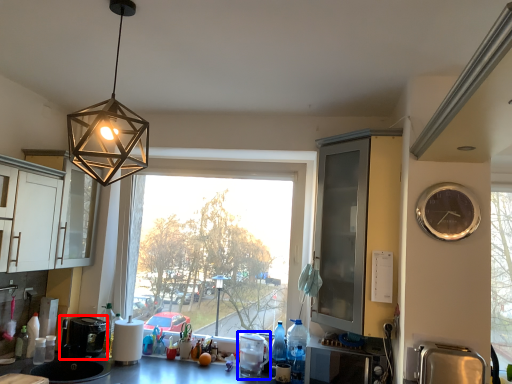
Question: Which of the following is the closest to the observer, coffee machine (highlighted by a red box) or appliance (highlighted by a blue box)?

Choices:
 (A) coffee machine
 (B) appliance

Answer: (B)